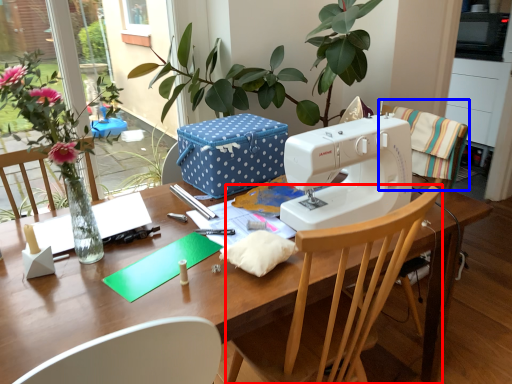
Question: Which of the following is the closest to the observer, chair (highlighted by a red box) or chair (highlighted by a blue box)?

Choices:
 (A) chair
 (B) chair

Answer: (A)